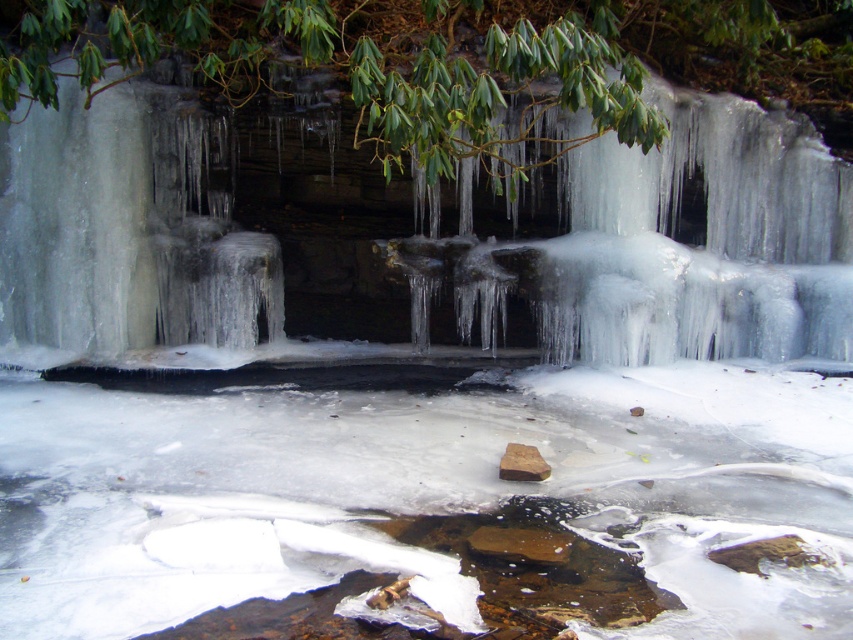
Is green leafy branch at upper center behind clear ice waterfall at upper center?

No, green leafy branch at upper center is closer to the viewer.

Is point (434, 0) behind point (585, 310)?

No, it is in front of (585, 310).

Between point (843, 92) and point (567, 337), which one is positioned in front?

Point (567, 337) is more forward.

You are a GUI agent. You are given a task and a screenshot of the screen. Output one action in this format:
    pyautogui.click(x=<x>, y=<y>)
    Task: Click on the green leafy branch at upper center
    This screenshot has height=640, width=853.
    Given the screenshot: What is the action you would take?
    pyautogui.click(x=447, y=58)

Describe the element at coordinates (447, 58) in the screenshot. The width and height of the screenshot is (853, 640). I see `green leafy branch at upper center` at that location.

Can you confirm if green leafy branch at upper center is positioned below brown matte stone at center?

No, green leafy branch at upper center is not below brown matte stone at center.

Is point (747, 51) farther from viewer compared to point (538, 458)?

Yes, point (747, 51) is behind point (538, 458).

This screenshot has width=853, height=640. What are the coordinates of `green leafy branch at upper center` in the screenshot? It's located at pos(447,58).

From the picture: Between clear ice waterfall at upper center and brown matte stone at center, which one appears on the right side from the viewer's perspective?

Positioned to the right is clear ice waterfall at upper center.

Can you confirm if clear ice waterfall at upper center is thinner than brown matte stone at center?

No, clear ice waterfall at upper center is not thinner than brown matte stone at center.

Locate an element on the screen. Image resolution: width=853 pixels, height=640 pixels. clear ice waterfall at upper center is located at coordinates (703, 241).

Locate an element on the screen. clear ice waterfall at upper center is located at coordinates (703, 241).